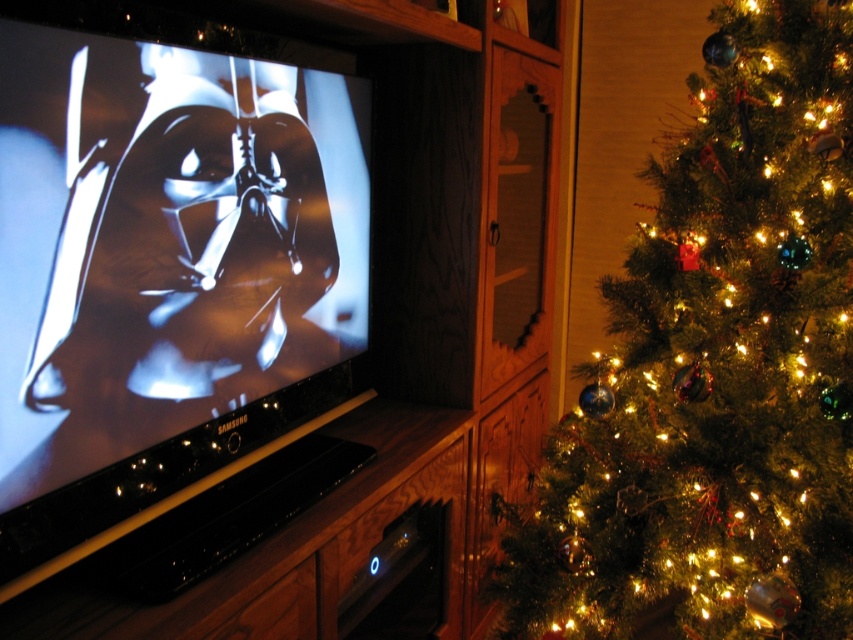
You are planning to place a new rectangular TV stand that is 1.5 meters wide. You want to place it where the black glossy entertainment center at center currently is. Considering the space, will the new TV stand fit if the green matte christmas tree at right is still in its current position?

The black glossy entertainment center at center is wider than the green matte christmas tree at right. Since the new TV stand is 1.5 meters wide, and the existing entertainment center is already wider than the tree, the new stand should fit in the same space without interfering with the tree.

You are standing in front of the television and want to walk towards the Christmas tree. Which direction should you move to reach the green matte christmas tree at right from the black glossy entertainment center at center?

You should move to the right from the black glossy entertainment center at center to reach the green matte christmas tree at right since the entertainment center is to the left of the Christmas tree.

You are standing in front of the TV and want to place a small decoration exactly at point (x=270, y=316). Which object should you place it on?

The point (x=270, y=316) is on the black glossy entertainment center at center, so you should place the decoration there.